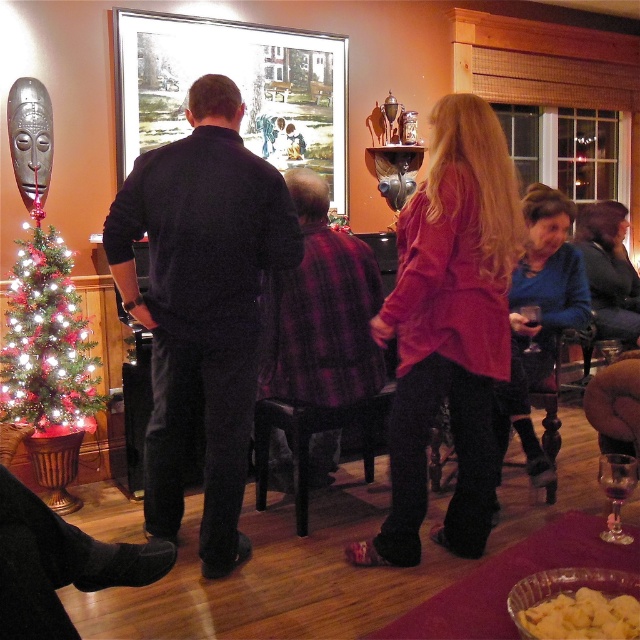
You are standing in the room and want to move from the point at coordinates point (253, 278) to the point at coordinates point (524, 314). Can you walk directly between them without any obstacles?

Point (253, 278) is in front of point (524, 314), so there is an obstacle blocking the path between them. You cannot walk directly between them without any obstacles.

You are at a party and want to grab a drink. You see a transparent glass wine glass at lower right and a transparent glass at center. Which glass is closer to you?

The transparent glass wine glass at lower right is closer to you because it is in front of the transparent glass at center.

Which object is wider, the transparent glass wine glass at lower right or the transparent glass at center?

The transparent glass wine glass at lower right is wider than transparent glass at center according to the description.